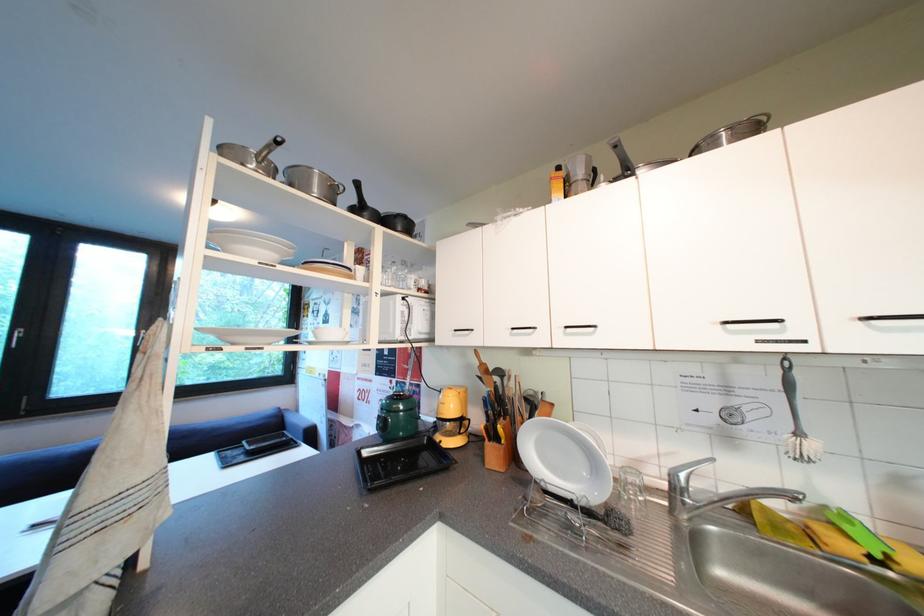
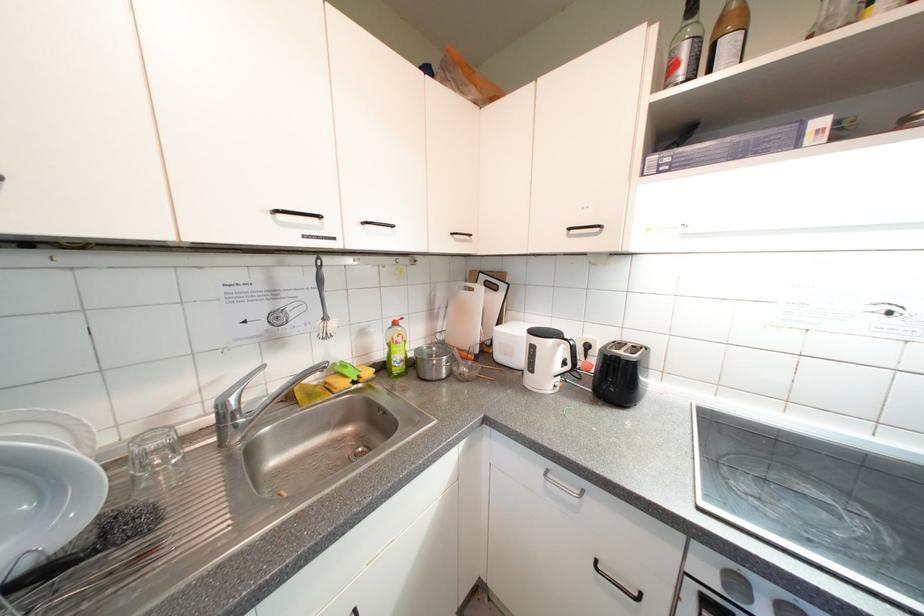
In the second image, find the point that corresponds to the point at 735,325 in the first image.

(285, 214)